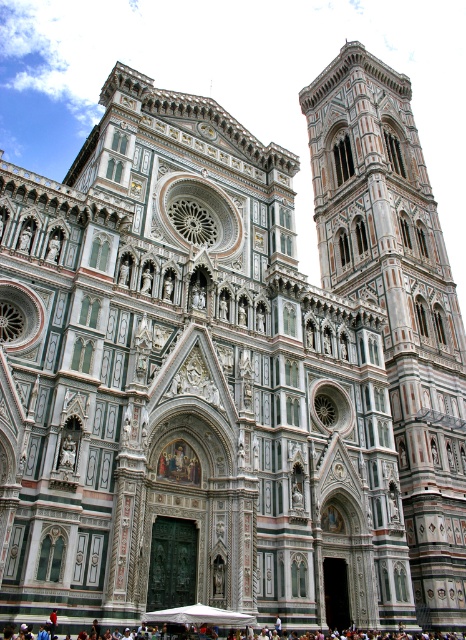
You are standing in front of the Florence Cathedral and want to take a photo of the white marble bell tower at right without the dark brown leather bag at lower center appearing in the frame. Is this possible given their positions?

The white marble bell tower at right is positioned over the dark brown leather bag at lower center, so if you aim your camera to capture the bell tower, the bag will likely be in the lower part of the frame. To exclude the bag, you could try tilting the camera upward or moving to a position where the bag is out of the shot.

You are standing in front of the Florence Cathedral and want to take a photo that includes both the white marble bell tower at right and the central rose window. Given that the bell tower is 169.32 feet away from your current position, is there enough space between you and the bell tower to fit both elements in the frame?

The white marble bell tower at right is 169.32 feet away from your current position. Since the distance between you and the bell tower allows for capturing both the central rose window and the bell tower in the same frame, yes, there is enough space.